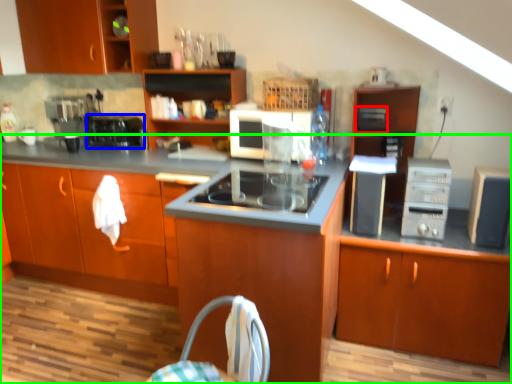
Question: Based on their relative distances, which object is nearer to appliance (highlighted by a red box)? Choose from kitchen appliance (highlighted by a blue box) and cabinetry (highlighted by a green box).

Choices:
 (A) kitchen appliance
 (B) cabinetry

Answer: (B)